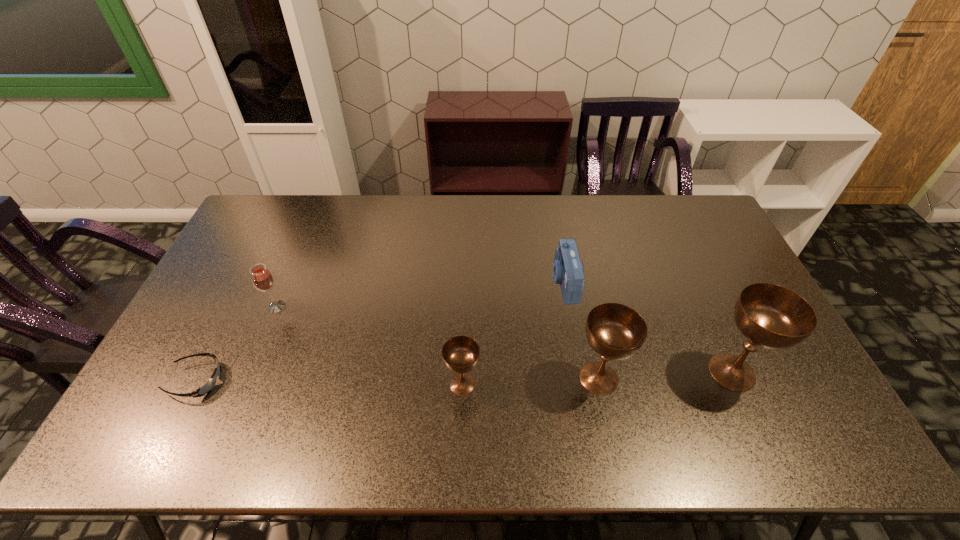
The height and width of the screenshot is (540, 960). Find the location of `blank region between the rightmost chalice and the second chalice from right to left`. blank region between the rightmost chalice and the second chalice from right to left is located at coordinates (665, 375).

Find the location of `vacant space that's between the fifth shortest object and the rightmost chalice`. vacant space that's between the fifth shortest object and the rightmost chalice is located at coordinates (665, 375).

At what (x,y) coordinates should I click in order to perform the action: click on free spot between the fifth tallest object and the shortest object. Please return your answer as a coordinate pair (x, y). Looking at the image, I should click on (380, 331).

At what (x,y) coordinates should I click in order to perform the action: click on free spot between the second tallest object and the shortest object. Please return your answer as a coordinate pair (x, y). Looking at the image, I should click on (397, 379).

The image size is (960, 540). What are the coordinates of `free space that is in between the camera and the rightmost chalice` in the screenshot? It's located at (648, 327).

Where is `unoccupied position between the second tallest chalice and the rightmost chalice`? The width and height of the screenshot is (960, 540). unoccupied position between the second tallest chalice and the rightmost chalice is located at coordinates (665, 375).

Find the location of a particular element. Image resolution: width=960 pixels, height=540 pixels. the fifth closest object to the wineglass is located at coordinates (771, 316).

At what (x,y) coordinates should I click in order to perform the action: click on object that is the fourth closest to the rightmost object. Please return your answer as a coordinate pair (x, y). The width and height of the screenshot is (960, 540). Looking at the image, I should click on (262, 278).

Image resolution: width=960 pixels, height=540 pixels. I want to click on chalice that is the second closest to the shortest chalice, so click(x=771, y=316).

Where is `chalice that is the second closest one to the shortest chalice`? chalice that is the second closest one to the shortest chalice is located at coordinates (771, 316).